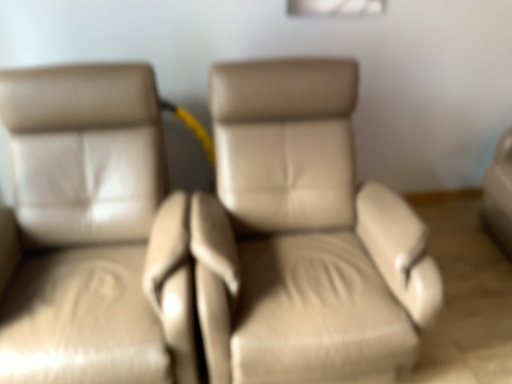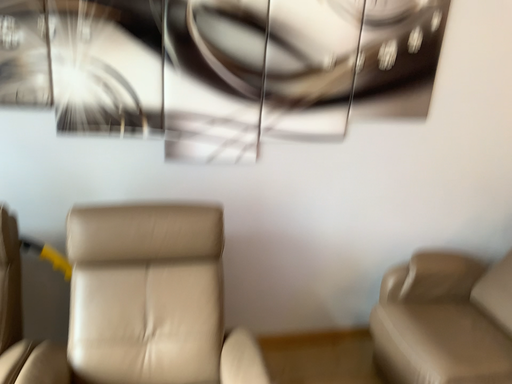
Question: Which way did the camera rotate in the video?

Choices:
 (A) rotated left
 (B) rotated right

Answer: (B)